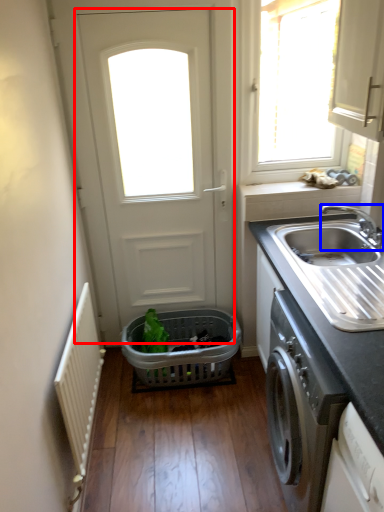
Question: Which object appears closest to the camera in this image, door (highlighted by a red box) or tap (highlighted by a blue box)?

Choices:
 (A) door
 (B) tap

Answer: (B)